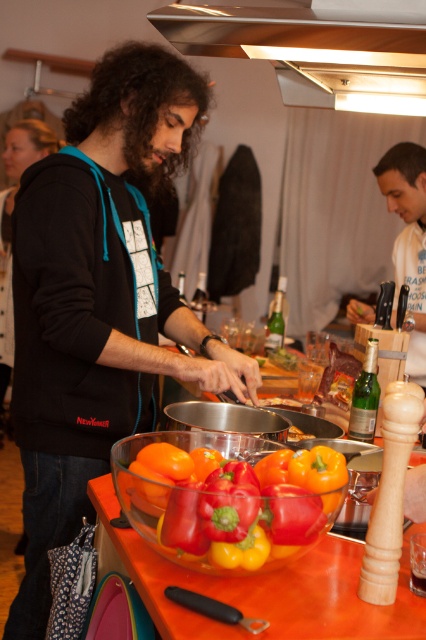
You are standing in the kitchen and see the black matte hoodie at center. If you want to reach it without moving your feet, can you do it?

The black matte hoodie at center is 4.19 feet away from you, so you cannot reach it without moving your feet since that distance is too far.

Looking at this image, you are standing in the kitchen and want to reach a point that is exactly 1.28 meters away from you. Can you confirm if the point you are aiming for is the point at coordinates (60, 317)?

The point at coordinates (60, 317) is 1.28 meters away from the camera, so yes, the point you are aiming for is exactly at that distance.

You are organizing a charity event and need to display two items on a shelf. The black matte hoodie at center and the white cotton shirt at upper right must be arranged so that the taller item is placed at the back for visibility. Which item should be placed at the back?

The black matte hoodie at center is taller than the white cotton shirt at upper right, so it should be placed at the back to ensure visibility.